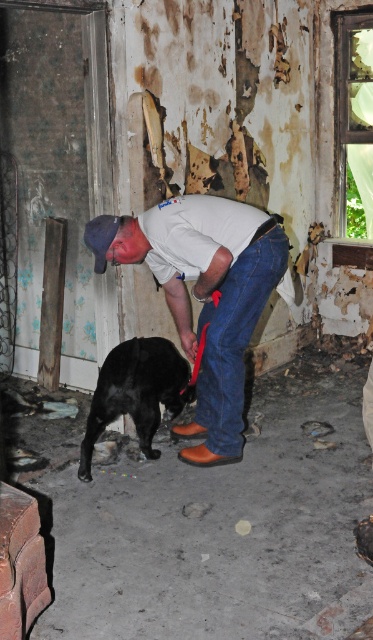
Is point (95, 260) behind point (149, 422)?

No, (95, 260) is in front of (149, 422).

Is point (129, 232) less distant than point (164, 374)?

Yes.

Measure the distance between white matte shirt at center and camera.

white matte shirt at center is 3.54 meters from camera.

This screenshot has width=373, height=640. Identify the location of white matte shirt at center. (204, 296).